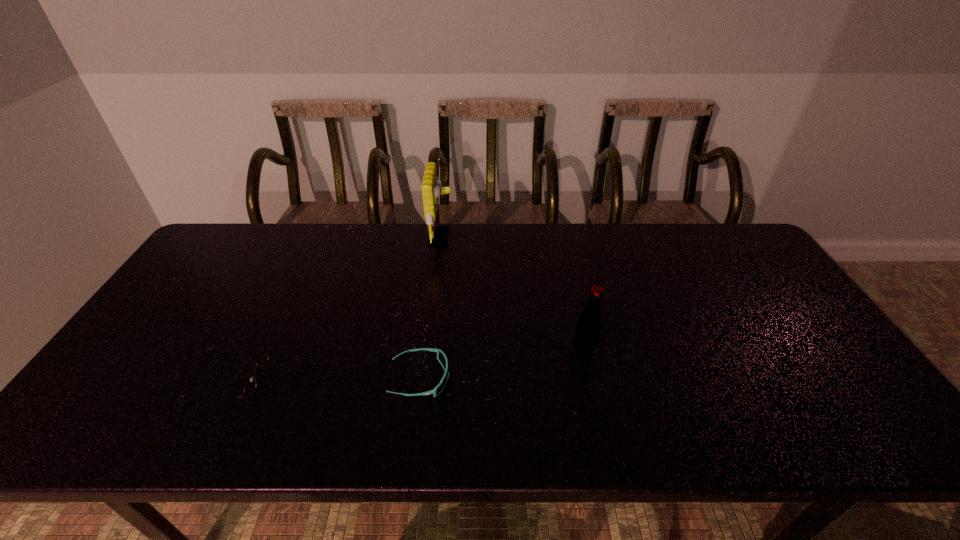
Locate an element on the screen. the farthest object is located at coordinates (431, 187).

Identify the location of beer bottle. This screenshot has height=540, width=960. (589, 325).

This screenshot has width=960, height=540. I want to click on the third shortest object, so click(x=589, y=325).

Where is `the leftmost object`? the leftmost object is located at coordinates (250, 388).

This screenshot has height=540, width=960. In order to click on the right sunglasses in this screenshot , I will do `click(441, 356)`.

Find the location of a particular element. This screenshot has height=540, width=960. vacant space positioned 0.380m on the face of the farthest object is located at coordinates (564, 238).

Identify the location of free space located 0.130m on the front of the third shortest object. This screenshot has width=960, height=540. (596, 404).

You are a GUI agent. You are given a task and a screenshot of the screen. Output one action in this format:
    pyautogui.click(x=<x>, y=<y>)
    Task: Click on the vacant region located 0.210m on the front-facing side of the leftmost object
    The image size is (960, 540).
    Given the screenshot: What is the action you would take?
    click(348, 380)

You are a GUI agent. You are given a task and a screenshot of the screen. Output one action in this format:
    pyautogui.click(x=<x>, y=<y>)
    Task: Click on the vacant space located 0.260m on the front-facing side of the right sunglasses
    
    Given the screenshot: What is the action you would take?
    pyautogui.click(x=557, y=379)

Find the location of a particular element. This screenshot has width=960, height=540. object that is at the far edge is located at coordinates [x=431, y=187].